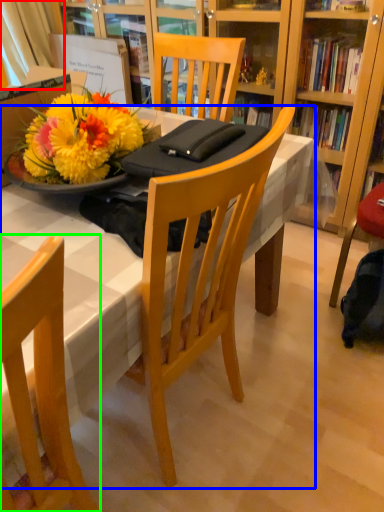
Question: Estimate the real-world distances between objects in this image. Which object is farther from curtain (highlighted by a red box), desk (highlighted by a blue box) or chair (highlighted by a green box)?

Choices:
 (A) desk
 (B) chair

Answer: (B)